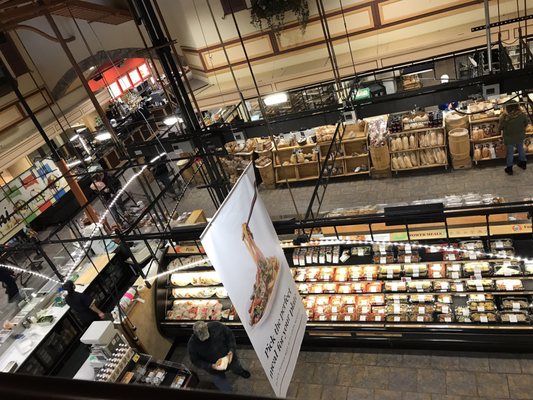
At what (x,y) coordinates should I click in order to perform the action: click on dark brown tiled floor. Please return your answer as a coordinate pair (x, y). Looking at the image, I should click on (387, 378).